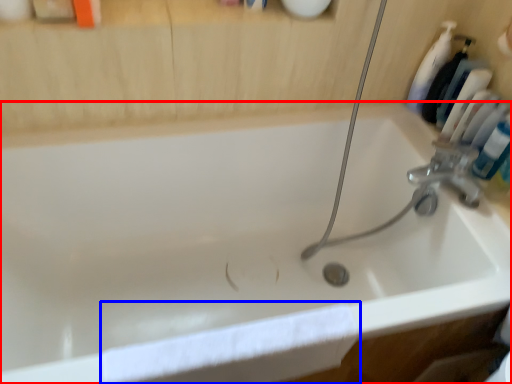
Question: Which object is further to the camera taking this photo, bathtub (highlighted by a red box) or bath towel (highlighted by a blue box)?

Choices:
 (A) bathtub
 (B) bath towel

Answer: (B)